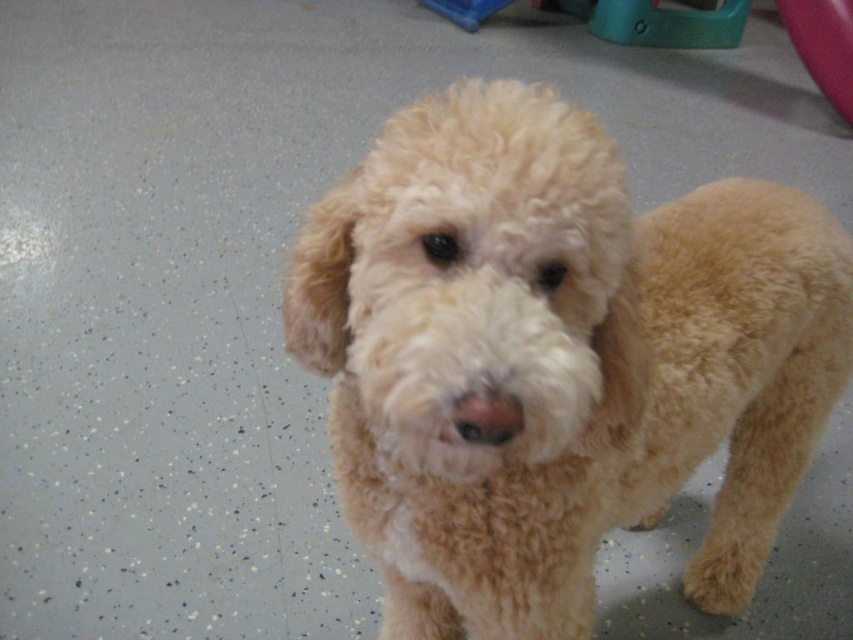
Question: Which point is closer to the camera?

Choices:
 (A) (790, 28)
 (B) (689, 12)
 (C) (828, 259)
 (D) (427, 1)

Answer: (C)

Question: Is the position of rubber at upper right less distant than that of blue plastic toy at upper center?

Choices:
 (A) yes
 (B) no

Answer: (A)

Question: Is teal plastic toy at upper right closer to the viewer compared to blue plastic toy at upper center?

Choices:
 (A) no
 (B) yes

Answer: (B)

Question: Can you confirm if teal plastic toy at upper right is smaller than rubber at upper right?

Choices:
 (A) yes
 (B) no

Answer: (B)

Question: Which object is the closest to the teal plastic toy at upper right?

Choices:
 (A) blue plastic toy at upper center
 (B) fuzzy beige dog at center
 (C) rubber at upper right

Answer: (A)

Question: Which point is closer to the camera taking this photo?

Choices:
 (A) click(x=463, y=397)
 (B) click(x=804, y=449)
 (C) click(x=735, y=45)

Answer: (A)